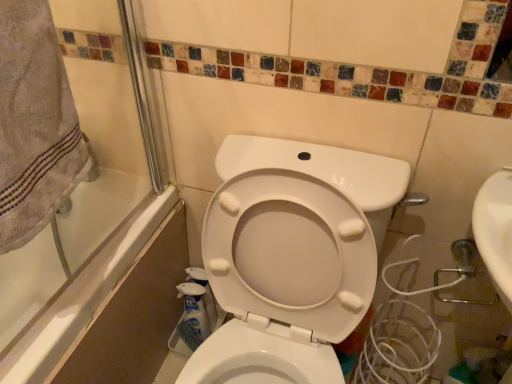
Question: Does white glossy bottle at lower center, marked as the first cleaning product in a back-to-front arrangement, come behind translucent plastic spray bottle at lower center, placed as the second cleaning product when sorted from back to front?

Choices:
 (A) yes
 (B) no

Answer: (A)

Question: Can we say white glossy bottle at lower center, the second cleaning product from the front, lies outside translucent plastic spray bottle at lower center, the 1th cleaning product when ordered from front to back?

Choices:
 (A) no
 (B) yes

Answer: (B)

Question: Considering the relative sizes of white glossy bottle at lower center, the second cleaning product from the front, and translucent plastic spray bottle at lower center, the 1th cleaning product when ordered from front to back, in the image provided, is white glossy bottle at lower center, the second cleaning product from the front, shorter than translucent plastic spray bottle at lower center, the 1th cleaning product when ordered from front to back,?

Choices:
 (A) no
 (B) yes

Answer: (A)

Question: From the image's perspective, does white glossy bottle at lower center, the second cleaning product from the front, appear higher than translucent plastic spray bottle at lower center, placed as the second cleaning product when sorted from back to front?

Choices:
 (A) yes
 (B) no

Answer: (A)

Question: Is white glossy bottle at lower center, the second cleaning product from the front, facing away from translucent plastic spray bottle at lower center, the 1th cleaning product when ordered from front to back?

Choices:
 (A) no
 (B) yes

Answer: (B)

Question: Could you tell me if white glossy bottle at lower center, marked as the first cleaning product in a back-to-front arrangement, is turned towards translucent plastic spray bottle at lower center, the 1th cleaning product when ordered from front to back?

Choices:
 (A) no
 (B) yes

Answer: (B)

Question: Is translucent plastic spray bottle at lower center, placed as the second cleaning product when sorted from back to front, further to the viewer compared to white glossy bathtub at left?

Choices:
 (A) yes
 (B) no

Answer: (A)

Question: Does translucent plastic spray bottle at lower center, the 1th cleaning product when ordered from front to back, have a greater width compared to white glossy bathtub at left?

Choices:
 (A) no
 (B) yes

Answer: (A)

Question: Does translucent plastic spray bottle at lower center, the 1th cleaning product when ordered from front to back, appear on the right side of white glossy bathtub at left?

Choices:
 (A) yes
 (B) no

Answer: (A)

Question: Is translucent plastic spray bottle at lower center, the 1th cleaning product when ordered from front to back, not near white glossy bathtub at left?

Choices:
 (A) yes
 (B) no

Answer: (B)

Question: Can you confirm if translucent plastic spray bottle at lower center, the 1th cleaning product when ordered from front to back, is bigger than white glossy bathtub at left?

Choices:
 (A) no
 (B) yes

Answer: (A)

Question: Does translucent plastic spray bottle at lower center, placed as the second cleaning product when sorted from back to front, have a greater height compared to white glossy bathtub at left?

Choices:
 (A) yes
 (B) no

Answer: (B)

Question: Can you confirm if beige cotton towel at upper left is taller than translucent plastic spray bottle at lower center, placed as the second cleaning product when sorted from back to front?

Choices:
 (A) no
 (B) yes

Answer: (B)